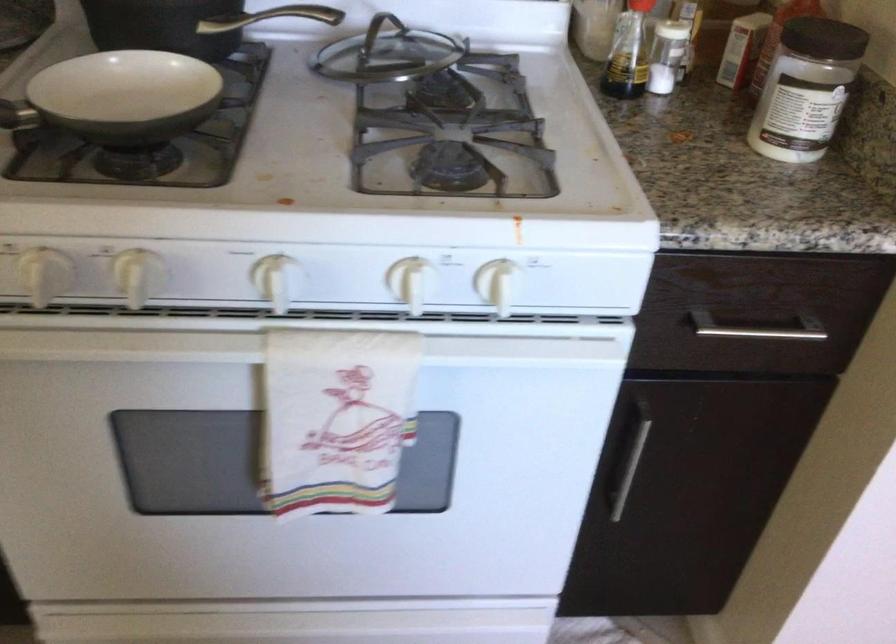
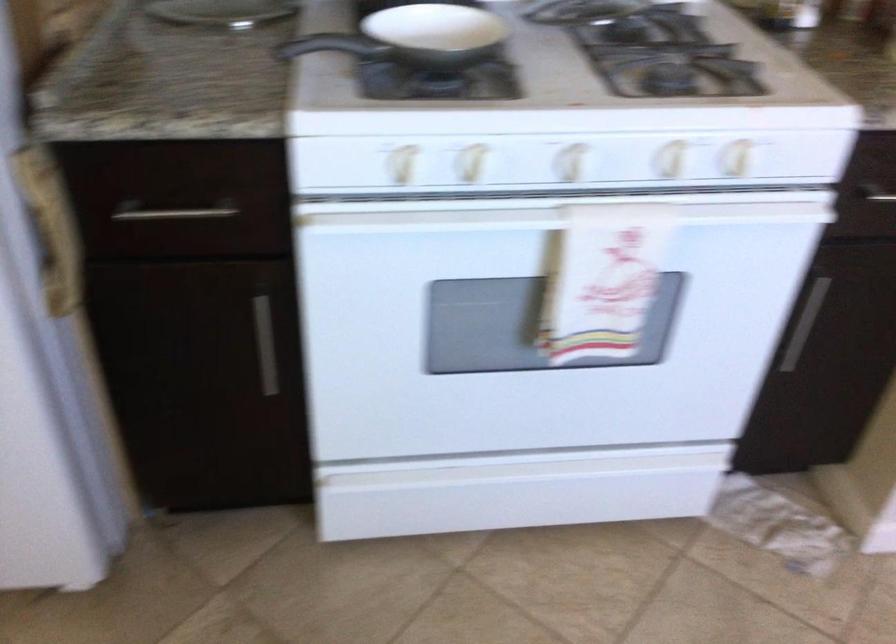
Where in the second image is the point corresponding to [410,285] from the first image?

(670, 158)